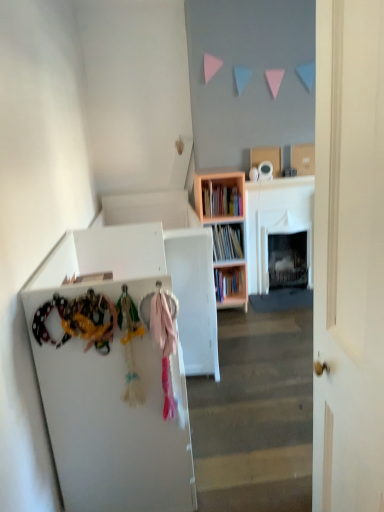
Question: Relative to pink wood bookcase at center, is pink fabric scarf at center in front or behind?

Choices:
 (A) front
 (B) behind

Answer: (A)

Question: From a real-world perspective, is pink fabric scarf at center above or below pink wood bookcase at center?

Choices:
 (A) below
 (B) above

Answer: (B)

Question: Estimate the real-world distances between objects in this image. Which object is farther from the pink fabric scarf at center?

Choices:
 (A) pink wood bookcase at center
 (B) white matte cabinet at left
 (C) wooden bookshelf at center
 (D) white matte door at center

Answer: (C)

Question: Which is farther from the pink wood bookcase at center?

Choices:
 (A) pink fabric scarf at center
 (B) white matte door at center
 (C) white matte cabinet at left
 (D) wooden bookshelf at center

Answer: (B)